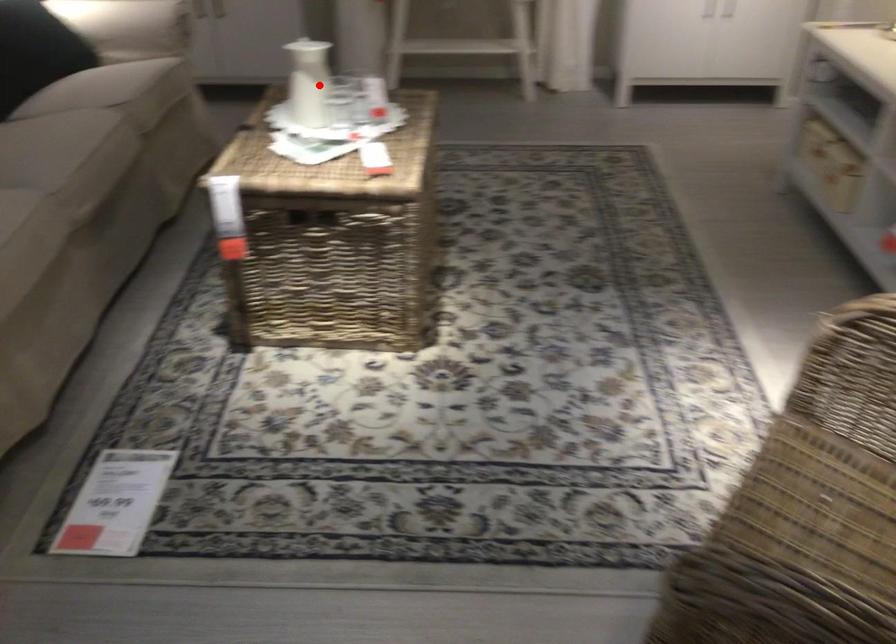
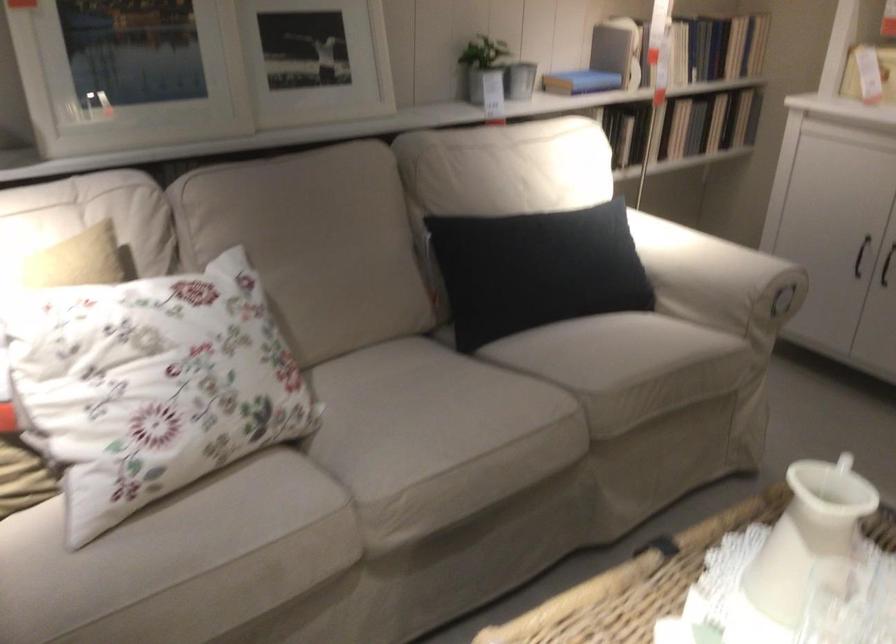
Question: I am providing you with two images of the same scene from different viewpoints. Image1 has a red point marked. In image2, the corresponding 3D location appears at what relative position? Reply with the corresponding letter.

Choices:
 (A) Closer
 (B) Farther

Answer: (A)